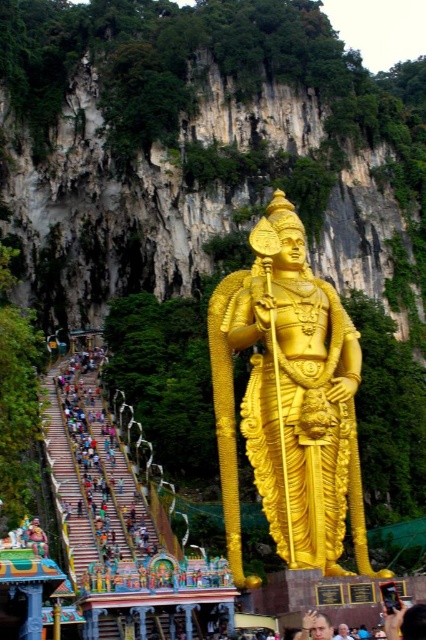
You are an art restorer examining the image. You need to move a ladder from the gold polished statue at center to the smooth skin face at lower center. Since the ladder is 1.5 meters wide, will it fit between them?

The gold polished statue at center is to the left of smooth skin face at lower center. Since the ladder is 1.5 meters wide, but the exact distance between them isn

Based on the photo, you are a photographer standing at the camera position. You want to take a photo of the gold polished statue at center. The statue is 49.11 meters away from you. Your camera has a maximum zoom range of 50 meters. Will you be able to capture the entire statue in your photo without moving closer?

→ The gold polished statue at center is 49.11 meters away from the camera. Since the camera has a maximum zoom range of 50 meters, you can capture the entire statue in your photo without moving closer.